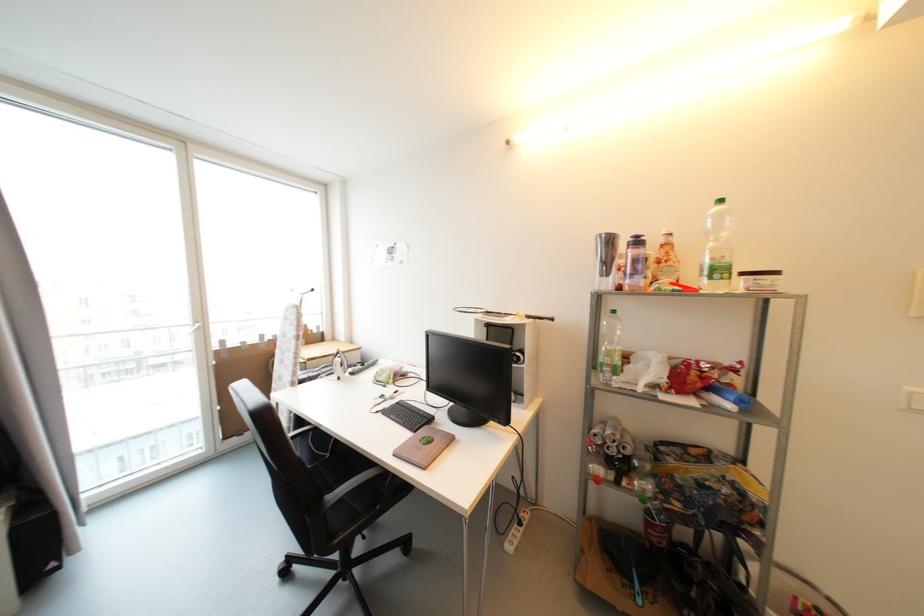
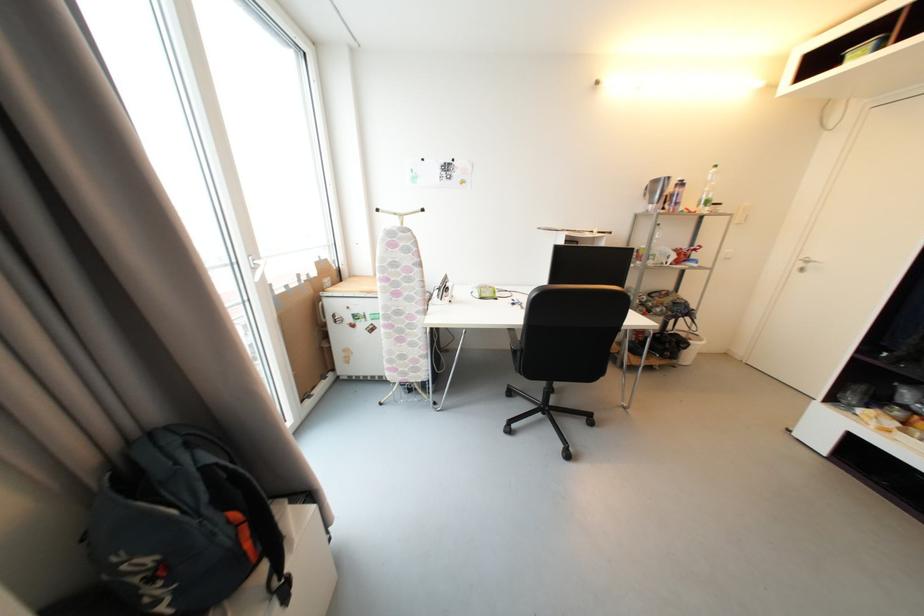
Question: I am providing you with two images of the same scene from different viewpoints. After the viewpoint changes to image2, which objects are now occluded?

Choices:
 (A) blue backpack
 (B) chair sitting surface
 (C) white window handle
 (D) none of these

Answer: (D)